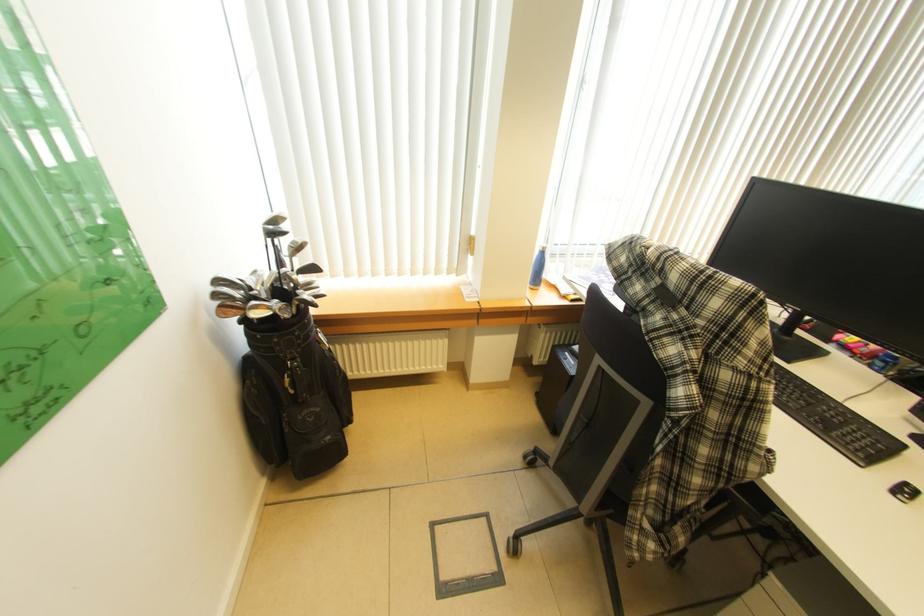
Where would you lift the floor panel handle? Please return your answer as a coordinate pair (x, y).

(454, 584)